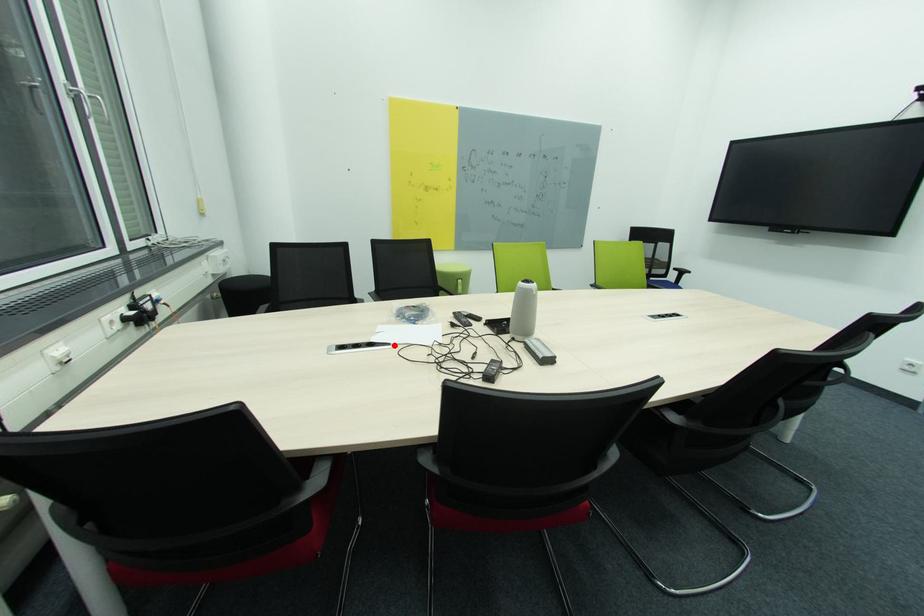
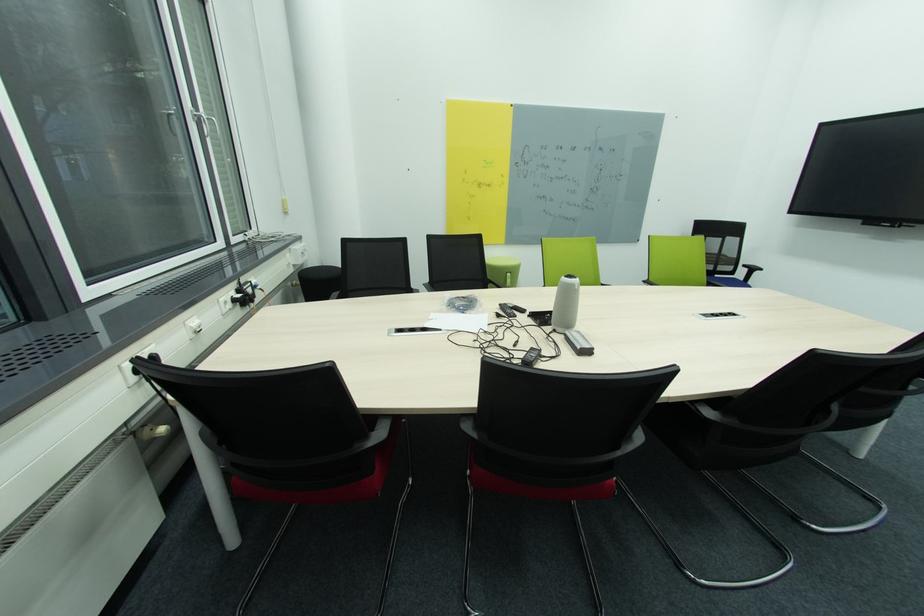
The point at the highlighted location is marked in the first image. Where is the corresponding point in the second image?

(444, 331)